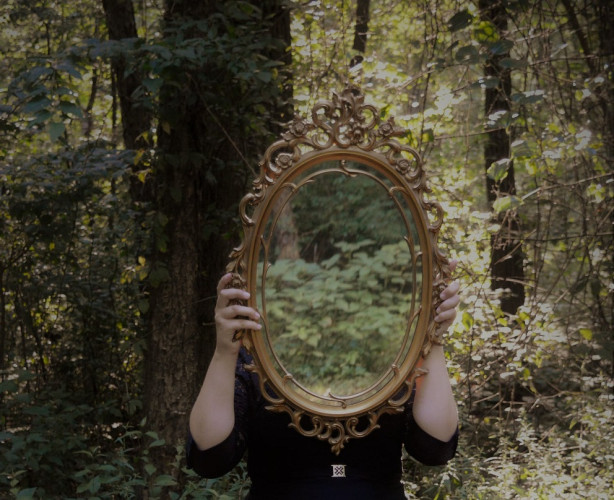
Identify the location of bevel around mirror. Image resolution: width=614 pixels, height=500 pixels. (354, 153).